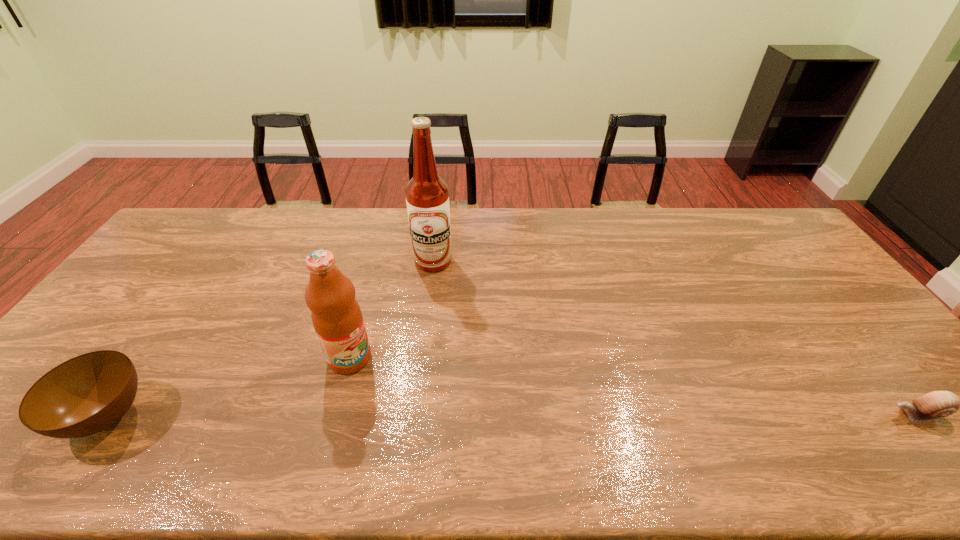
Locate an element on the screen. The width and height of the screenshot is (960, 540). vacant space in between the third nearest object and the leftmost object is located at coordinates (228, 387).

The height and width of the screenshot is (540, 960). What are the coordinates of `vacant space that's between the escargot and the leftmost object` in the screenshot? It's located at 512,415.

The image size is (960, 540). I want to click on free space between the alcohol and the fruit juice, so click(x=392, y=309).

Locate an element on the screen. free point between the rightmost object and the second object from left to right is located at coordinates (633, 386).

In order to click on free space between the rightmost object and the second shortest object in this screenshot , I will do `click(512, 415)`.

This screenshot has width=960, height=540. I want to click on vacant area that lies between the rightmost object and the bowl, so click(x=512, y=415).

Locate an element on the screen. The width and height of the screenshot is (960, 540). free spot between the leftmost object and the escargot is located at coordinates (512, 415).

Image resolution: width=960 pixels, height=540 pixels. Find the location of `object that can be found as the second closest to the fruit juice`. object that can be found as the second closest to the fruit juice is located at coordinates click(82, 396).

Image resolution: width=960 pixels, height=540 pixels. I want to click on object that is the second nearest to the rightmost object, so click(336, 315).

Where is `free location that satisfies the following two spatial constraints: 1. on the front side of the escargot; 2. on the front-facing side of the fruit juice`? free location that satisfies the following two spatial constraints: 1. on the front side of the escargot; 2. on the front-facing side of the fruit juice is located at coordinates (334, 414).